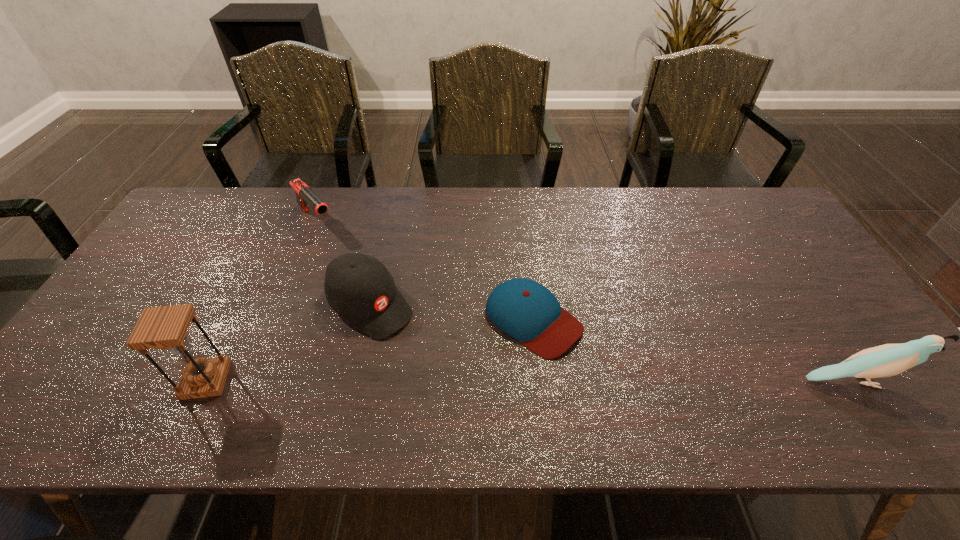
Where is `hourglass`? This screenshot has width=960, height=540. hourglass is located at coordinates (165, 327).

Image resolution: width=960 pixels, height=540 pixels. Find the location of `the rightmost object`. the rightmost object is located at coordinates (887, 360).

Locate an element on the screen. The height and width of the screenshot is (540, 960). the second tallest object is located at coordinates (887, 360).

I want to click on the left baseball cap, so click(x=359, y=287).

Locate an element on the screen. The height and width of the screenshot is (540, 960). the taller baseball cap is located at coordinates (359, 287).

What are the coordinates of `the farthest object` in the screenshot? It's located at (305, 196).

The height and width of the screenshot is (540, 960). What are the coordinates of `the right baseball cap` in the screenshot? It's located at (527, 311).

Where is `the fourth object from left to right`? The image size is (960, 540). the fourth object from left to right is located at coordinates (527, 311).

Identify the location of free location located 0.140m on the left of the tallest object. (124, 380).

Image resolution: width=960 pixels, height=540 pixels. I want to click on free space located with a logo on the front of the left baseball cap, so click(473, 392).